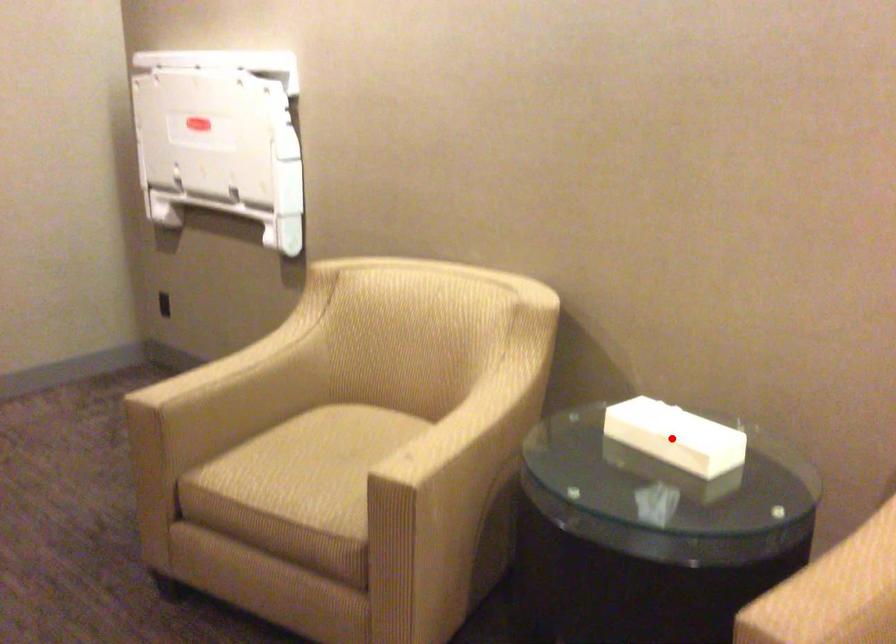
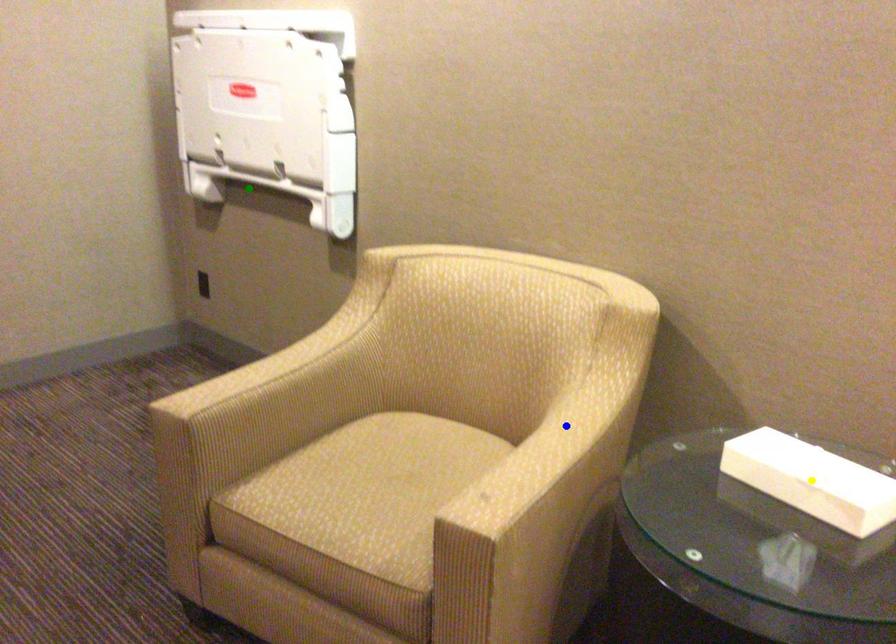
Question: I am providing you with two images of the same scene from different viewpoints. A red point is marked on the first image. You are given multiple points on the second image. In image 2, which mark is for the same physical point as the one in image 1?

Choices:
 (A) blue point
 (B) yellow point
 (C) green point

Answer: (B)